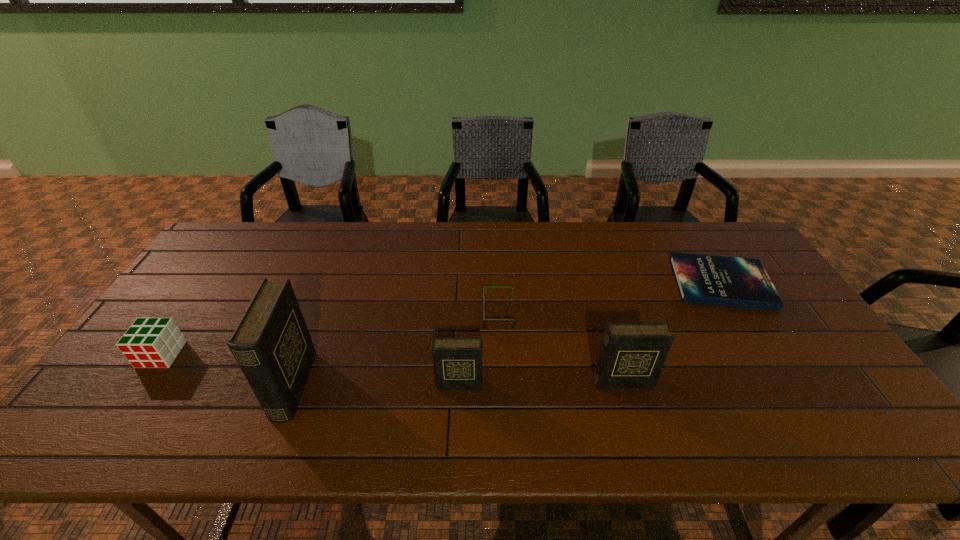
You are a GUI agent. You are given a task and a screenshot of the screen. Output one action in this format:
    pyautogui.click(x=<x>, y=<y>)
    Task: Click on the free spot between the rightmost diary and the leftmost object
    The image size is (960, 540).
    Given the screenshot: What is the action you would take?
    pyautogui.click(x=392, y=368)

Locate an element on the screen. vacant space in between the rightmost diary and the shortest diary is located at coordinates (540, 382).

Find the location of a particular element. vacant point located between the shortest diary and the rightmost object is located at coordinates (589, 333).

Identify which object is the fifth nearest to the third object from right to left. Please provide its 2D coordinates. Your answer should be formatted as a tuple, i.e. [(x, y)], where the tuple contains the x and y coordinates of a point satisfying the conditions above.

[(150, 342)]

Identify which object is located as the nearest to the hardback book. Please provide its 2D coordinates. Your answer should be formatted as a tuple, i.e. [(x, y)], where the tuple contains the x and y coordinates of a point satisfying the conditions above.

[(632, 355)]

Where is `diary that is the third closest to the hardback book`? This screenshot has width=960, height=540. diary that is the third closest to the hardback book is located at coordinates (272, 345).

Locate which diary ranks third in proximity to the fourth tallest object. Please provide its 2D coordinates. Your answer should be formatted as a tuple, i.e. [(x, y)], where the tuple contains the x and y coordinates of a point satisfying the conditions above.

[(632, 355)]

Identify the location of vacant space that satisfies the following two spatial constraints: 1. on the front cover of the fifth shortest object; 2. on the front cover of the second object from left to right. (624, 386).

Where is `free space that satisfies the following two spatial constraints: 1. on the front cover of the third tallest object; 2. on the front cover of the fifth object from right to left`? The image size is (960, 540). free space that satisfies the following two spatial constraints: 1. on the front cover of the third tallest object; 2. on the front cover of the fifth object from right to left is located at coordinates (459, 386).

The width and height of the screenshot is (960, 540). I want to click on vacant area that satisfies the following two spatial constraints: 1. on the front side of the rightmost object; 2. on the front cover of the tallest object, so click(784, 386).